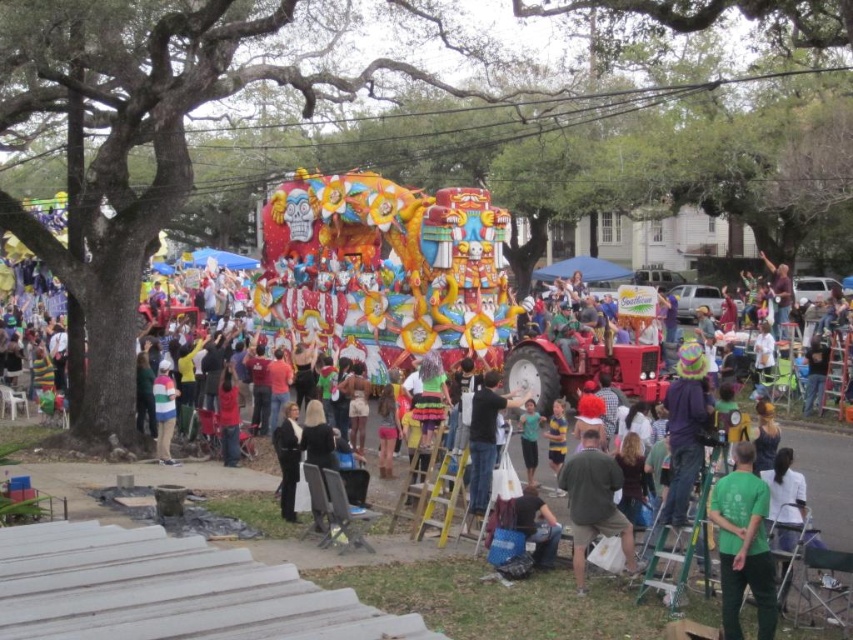
Question: Can you confirm if dark blue jeans at center is smaller than striped sweater at center?

Choices:
 (A) yes
 (B) no

Answer: (B)

Question: Is green fabric shirt at lower center positioned before dark blue jeans at center?

Choices:
 (A) no
 (B) yes

Answer: (B)

Question: Which object is closer to the camera taking this photo?

Choices:
 (A) green cotton shirt at center
 (B) dark blue jeans at center
 (C) black leather pants at lower center
 (D) striped sweater at center

Answer: (A)

Question: Is black leather pants at lower center below striped sweater at center?

Choices:
 (A) no
 (B) yes

Answer: (B)

Question: Which object is the farthest from the striped sweater at center?

Choices:
 (A) green fabric shirt at lower center
 (B) dark blue jeans at center

Answer: (A)

Question: Which of the following is the farthest from the observer?

Choices:
 (A) (171, 376)
 (B) (296, 417)
 (C) (602, 493)
 (D) (488, 481)

Answer: (A)